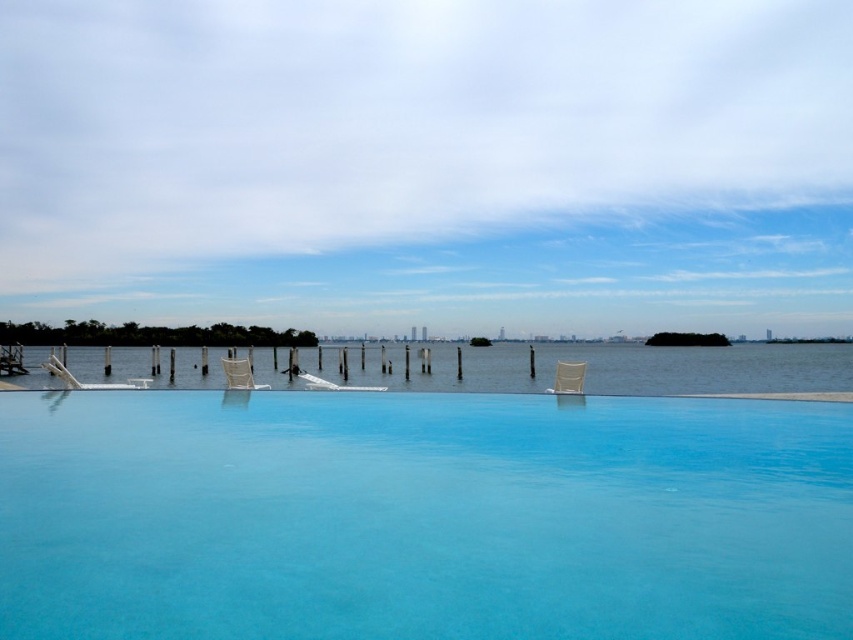
You are standing at the edge of the infinity pool and want to place a small umbrella on the beige fabric beach chair at center. Based on the scene, can the umbrella be placed without it touching the clear blue water at center?

The clear blue water at center is taller than the beige fabric beach chair at center, so the umbrella placed on the beige fabric beach chair at center would be submerged in the water and touch it.

You are standing at the edge of the scene and want to walk towards the transparent glass pool at center and the clear blue water at center. Which one will you reach first?

The transparent glass pool at center is to the left of clear blue water at center, so you will reach the transparent glass pool at center first since it is closer to your starting position at the edge of the scene.

You are standing at the edge of the infinity pool and notice the clear blue water at center and the beige fabric beach chair at center. Which object is closer to you?

The beige fabric beach chair at center is closer to you because it is positioned above the clear blue water at center.